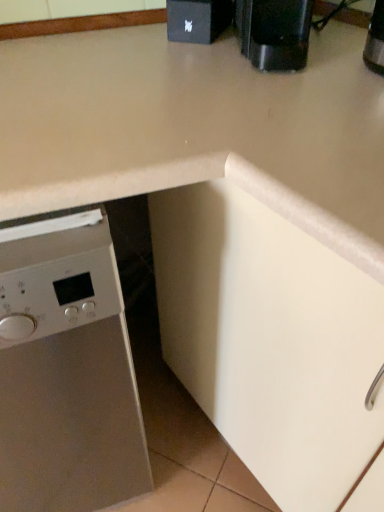
Question: From the image's perspective, is black plastic coffee machine at upper right located beneath black matte speaker at upper center?

Choices:
 (A) yes
 (B) no

Answer: (A)

Question: Considering the relative sizes of black plastic coffee machine at upper right and black matte speaker at upper center in the image provided, is black plastic coffee machine at upper right bigger than black matte speaker at upper center?

Choices:
 (A) no
 (B) yes

Answer: (B)

Question: Considering the relative sizes of black plastic coffee machine at upper right and black matte speaker at upper center in the image provided, is black plastic coffee machine at upper right taller than black matte speaker at upper center?

Choices:
 (A) no
 (B) yes

Answer: (B)

Question: From the image's perspective, is black plastic coffee machine at upper right on black matte speaker at upper center?

Choices:
 (A) yes
 (B) no

Answer: (B)

Question: Are black plastic coffee machine at upper right and black matte speaker at upper center located far from each other?

Choices:
 (A) yes
 (B) no

Answer: (B)

Question: From a real-world perspective, is black plastic coffee machine at upper right positioned over black matte speaker at upper center based on gravity?

Choices:
 (A) yes
 (B) no

Answer: (A)

Question: Is black matte speaker at upper center facing away from satin white dishwasher at left?

Choices:
 (A) no
 (B) yes

Answer: (A)

Question: Are black matte speaker at upper center and satin white dishwasher at left located far from each other?

Choices:
 (A) yes
 (B) no

Answer: (B)

Question: Can we say black matte speaker at upper center lies outside satin white dishwasher at left?

Choices:
 (A) no
 (B) yes

Answer: (B)

Question: From a real-world perspective, is black matte speaker at upper center positioned over satin white dishwasher at left based on gravity?

Choices:
 (A) yes
 (B) no

Answer: (A)

Question: Does black matte speaker at upper center turn towards satin white dishwasher at left?

Choices:
 (A) no
 (B) yes

Answer: (A)

Question: From the image's perspective, is black matte speaker at upper center beneath satin white dishwasher at left?

Choices:
 (A) no
 (B) yes

Answer: (A)

Question: Is satin white dishwasher at left outside black plastic coffee machine at upper right?

Choices:
 (A) no
 (B) yes

Answer: (B)